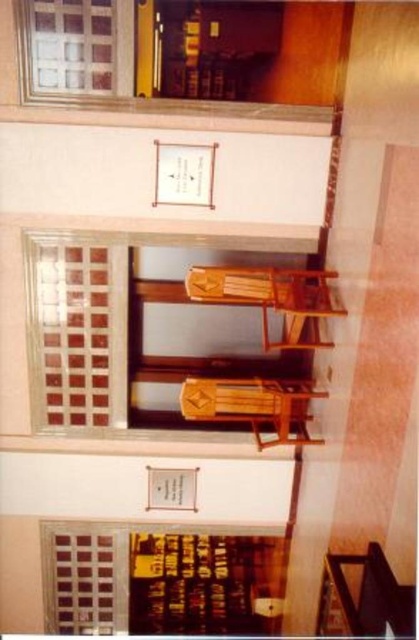
Question: Is matte glass window at lower left closer to camera compared to wooden bunk bed at center?

Choices:
 (A) yes
 (B) no

Answer: (B)

Question: Can you confirm if matte glass window at lower left is positioned to the right of wooden bunk bed at center?

Choices:
 (A) yes
 (B) no

Answer: (B)

Question: Which of the following is the closest to the observer?

Choices:
 (A) wooden bunk bed at center
 (B) matte glass window at lower left

Answer: (A)

Question: Is matte glass window at lower left positioned at the back of wooden bunk bed at center?

Choices:
 (A) no
 (B) yes

Answer: (B)

Question: Among these points, which one is nearest to the camera?

Choices:
 (A) (101, 577)
 (B) (232, 412)

Answer: (B)